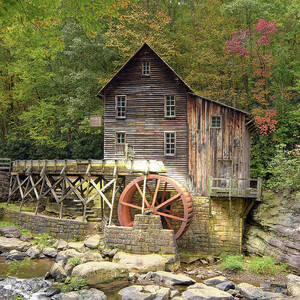
Image resolution: width=300 pixels, height=300 pixels. Find the location of `brick wall`. brick wall is located at coordinates (74, 231), (115, 234).